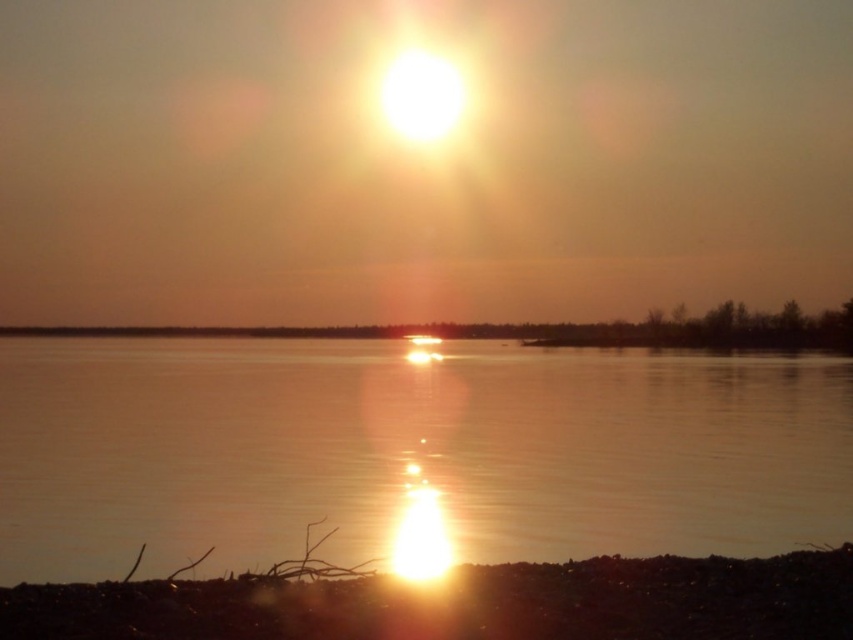
You are standing on the shore of the lake and see the translucent water at center and the smooth sand at center. Which object is located to the right when facing the water?

The translucent water at center is positioned on the right side of smooth sand at center, so when facing the water, the translucent water at center is to the right of the smooth sand at center.

You are standing on the shore and see both the translucent water at center and the smooth sand at center. Which one is located below the other?

The translucent water at center is positioned under the smooth sand at center, so the water is below the sand.